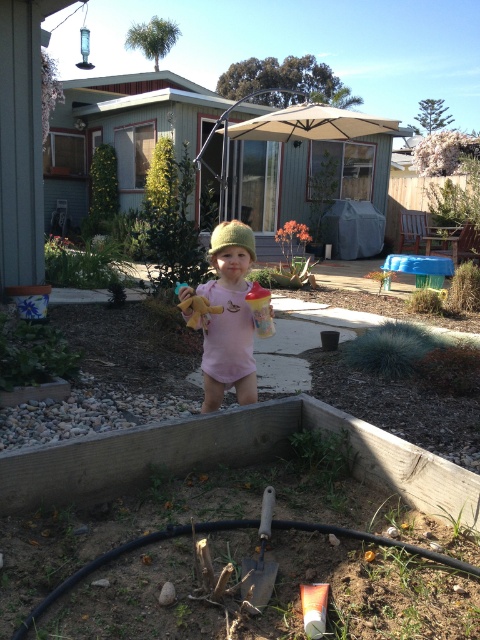
You are a parent trying to locate your child in the backyard. You see the black rubber garden hose at lower center and the knitted green hat at center. Which object is closer to you?

The black rubber garden hose at lower center is closer to you because it is in front of the knitted green hat at center.

Based on the photo, you are a parent who wants to hand your child the black rubber garden hose at lower center. The child is holding a sippy cup in one hand and a stuffed toy in the other. Can you reach the hose without moving closer than 1.5 meters from where you are standing?

The black rubber garden hose at lower center is 1.83 meters from the camera. Since you need to be within 1.5 meters to reach it, you cannot reach the hose without moving closer.